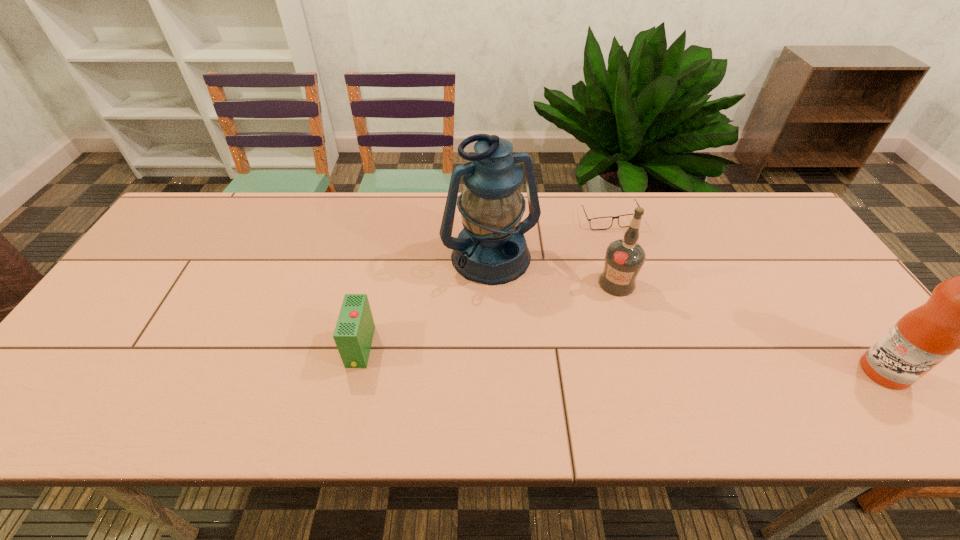
The width and height of the screenshot is (960, 540). Identify the location of free space on the desktop that is between the second shortest object and the second tallest object and is positioned with the lenses facing outward on the farthest object. (549, 356).

At what (x,y) coordinates should I click in order to perform the action: click on vacant space on the desktop that is between the alarm clock and the rightmost object and is positioned on the front label of the vodka. Please return your answer as a coordinate pair (x, y). This screenshot has height=540, width=960. Looking at the image, I should click on (633, 360).

Locate an element on the screen. This screenshot has width=960, height=540. free space on the desktop that is between the alarm clock and the fruit juice and is positioned on the face of the lantern is located at coordinates (548, 356).